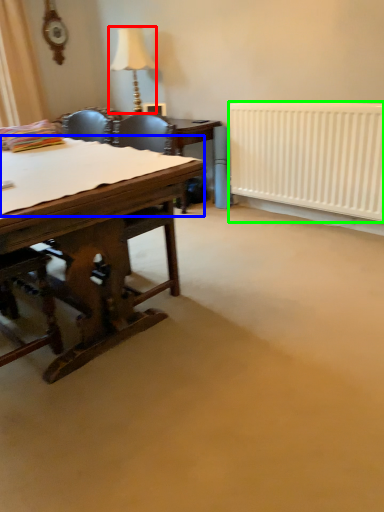
Question: Which object is the farthest from lamp (highlighted by a red box)? Choose among these: sheet (highlighted by a blue box) or radiator (highlighted by a green box).

Choices:
 (A) sheet
 (B) radiator

Answer: (A)